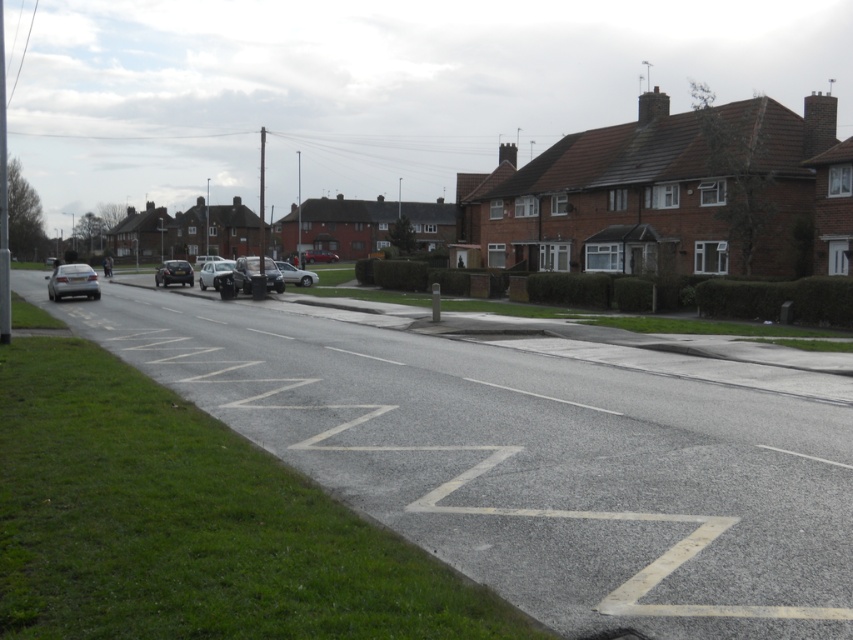
Question: Is shiny black car at center-left closer to the viewer compared to matte silver car at center?

Choices:
 (A) yes
 (B) no

Answer: (A)

Question: Which object appears closest to the camera in this image?

Choices:
 (A) white glossy car at center
 (B) shiny black sedan at center
 (C) shiny black car at center-left
 (D) shiny silver sedan at left

Answer: (D)

Question: Which point is closer to the camera taking this photo?

Choices:
 (A) (189, 285)
 (B) (210, 282)

Answer: (B)

Question: Does shiny black sedan at center have a larger size compared to matte silver car at center?

Choices:
 (A) yes
 (B) no

Answer: (A)

Question: Among these objects, which one is nearest to the camera?

Choices:
 (A) white asphalt road at center
 (B) shiny black sedan at center

Answer: (A)

Question: Does white asphalt road at center appear on the left side of silver metallic car at center?

Choices:
 (A) no
 (B) yes

Answer: (A)